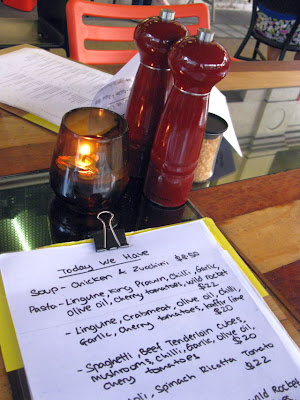
The height and width of the screenshot is (400, 300). I want to click on leg of person seated in chair, so click(x=272, y=52).